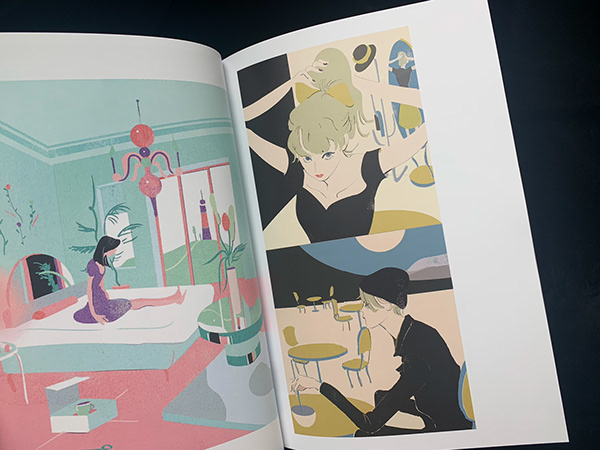
Where is `mirror`? The width and height of the screenshot is (600, 450). mirror is located at coordinates (399, 45).